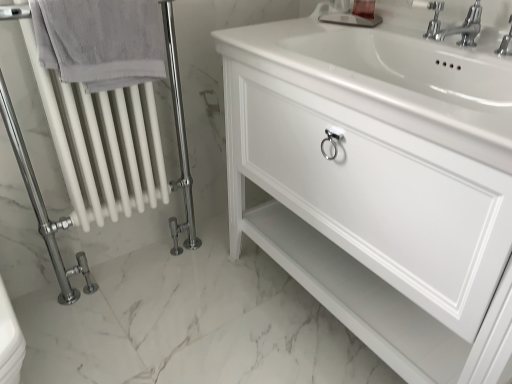
Question: Is gray cotton towel at left smaller than white glossy cabinet at center?

Choices:
 (A) yes
 (B) no

Answer: (A)

Question: Can white glossy cabinet at center be found inside gray cotton towel at left?

Choices:
 (A) no
 (B) yes

Answer: (A)

Question: Is gray cotton towel at left positioned beyond the bounds of white glossy cabinet at center?

Choices:
 (A) no
 (B) yes

Answer: (B)

Question: Is gray cotton towel at left further to camera compared to white glossy cabinet at center?

Choices:
 (A) yes
 (B) no

Answer: (A)

Question: Does gray cotton towel at left have a lesser width compared to white glossy cabinet at center?

Choices:
 (A) yes
 (B) no

Answer: (A)

Question: Could you tell me if gray cotton towel at left is facing white glossy cabinet at center?

Choices:
 (A) yes
 (B) no

Answer: (B)

Question: Is clear plastic soap at upper center at the right side of white glossy radiator at left?

Choices:
 (A) yes
 (B) no

Answer: (A)

Question: Can you confirm if clear plastic soap at upper center is taller than white glossy radiator at left?

Choices:
 (A) yes
 (B) no

Answer: (B)

Question: From the image's perspective, is clear plastic soap at upper center beneath white glossy radiator at left?

Choices:
 (A) no
 (B) yes

Answer: (A)

Question: Considering the relative sizes of clear plastic soap at upper center and white glossy radiator at left in the image provided, is clear plastic soap at upper center smaller than white glossy radiator at left?

Choices:
 (A) yes
 (B) no

Answer: (A)

Question: Is clear plastic soap at upper center looking in the opposite direction of white glossy radiator at left?

Choices:
 (A) no
 (B) yes

Answer: (A)

Question: Can you see clear plastic soap at upper center touching white glossy radiator at left?

Choices:
 (A) no
 (B) yes

Answer: (A)

Question: Are chrome metallic faucet at upper right and polished chrome faucet at upper right making contact?

Choices:
 (A) yes
 (B) no

Answer: (A)